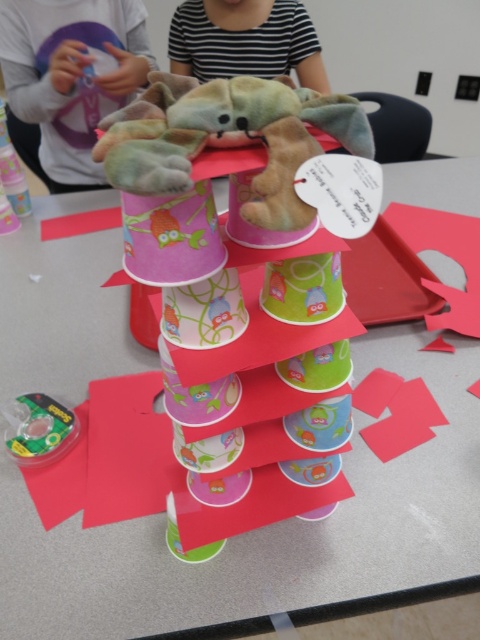
Does striped fabric stuffed animal at upper center appear under green plastic toy at lower left?

Incorrect, striped fabric stuffed animal at upper center is not positioned below green plastic toy at lower left.

In the scene shown: Is striped fabric stuffed animal at upper center closer to camera compared to green plastic toy at lower left?

No, it is not.

Image resolution: width=480 pixels, height=640 pixels. Identify the location of striped fabric stuffed animal at upper center. (245, 40).

Find the location of `striped fabric stuffed animal at upper center`. striped fabric stuffed animal at upper center is located at coordinates (245, 40).

Which is more to the right, soft plush toy at upper center or striped fabric stuffed animal at upper center?

striped fabric stuffed animal at upper center is more to the right.

The width and height of the screenshot is (480, 640). What do you see at coordinates (72, 76) in the screenshot?
I see `soft plush toy at upper center` at bounding box center [72, 76].

Where is `soft plush toy at upper center`? Image resolution: width=480 pixels, height=640 pixels. soft plush toy at upper center is located at coordinates (72, 76).

Is soft plush toy at center to the left of striped fabric stuffed animal at upper center from the viewer's perspective?

Yes, soft plush toy at center is to the left of striped fabric stuffed animal at upper center.

Measure the distance between soft plush toy at center and camera.

soft plush toy at center is 15.20 inches from camera.

Who is more forward, [219,116] or [176,22]?

Point [219,116]

Identify the location of soft plush toy at center. Image resolution: width=480 pixels, height=640 pixels. (228, 132).